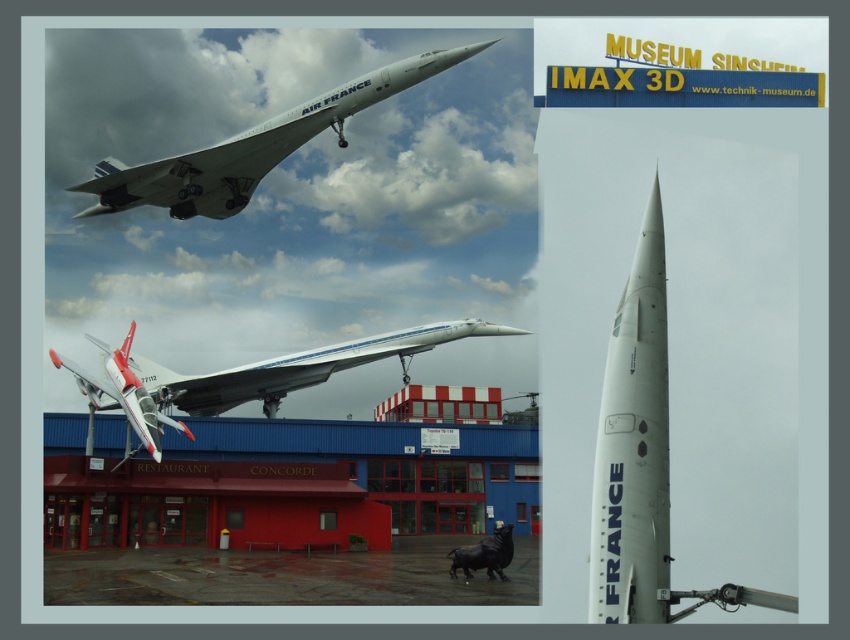
You are planning to take a photo of the red matte building at center and the white matte concorde at center. Which object should you focus on first if you want to capture both in the same frame without moving the camera?

The red matte building at center might be wider than the white matte concorde at center, so you should focus on the red matte building at center first to ensure it fits within the frame.

You are a visitor at the museum and want to take a photo of both the red matte building at center and the white matte concorde at center. Based on their positions, which one should you focus on first to ensure both are in the frame?

The red matte building at center is located below the white matte concorde at center, so you should focus on the white matte concorde at center first to ensure both are in the frame.